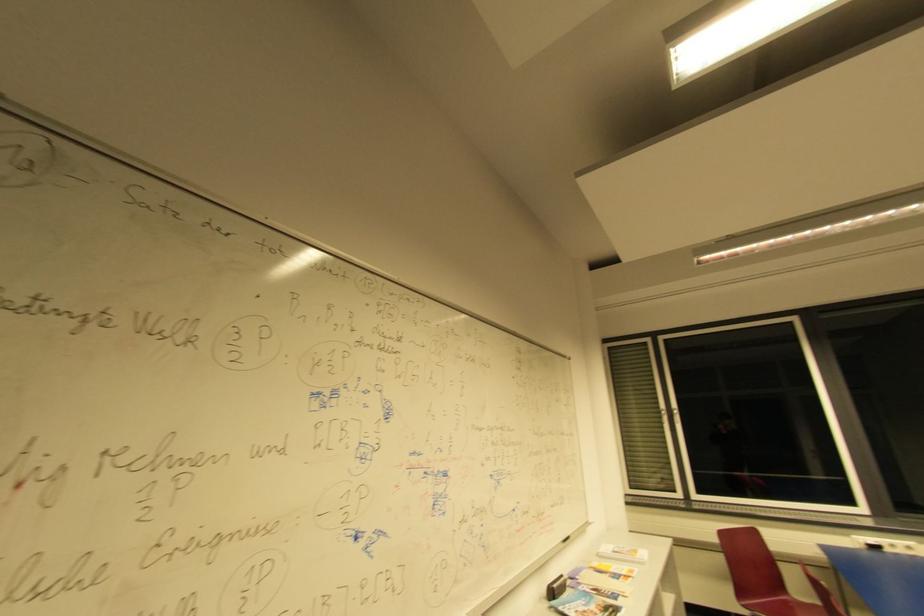
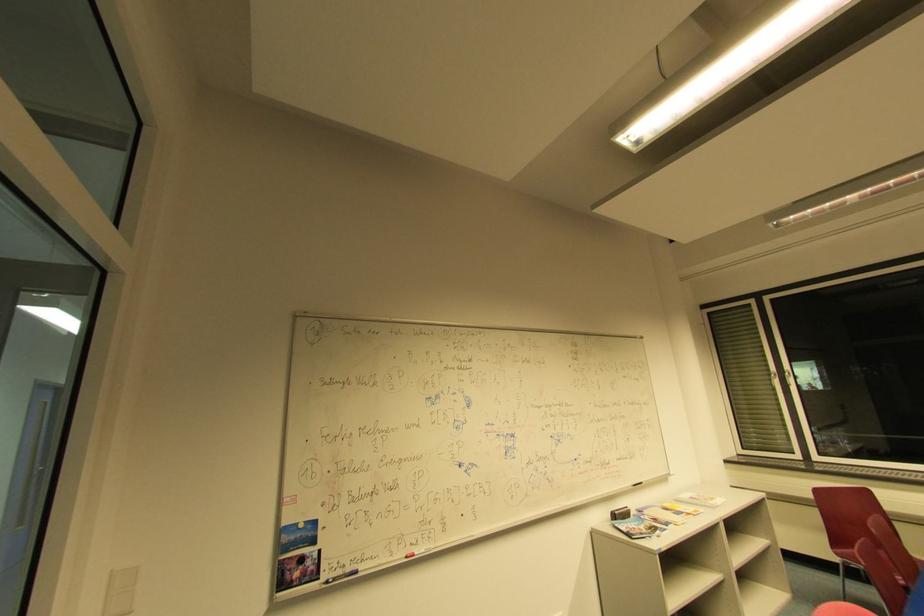
In the scene shown: The images are taken continuously from a first-person perspective. In which direction are you moving?

The cameraman moved toward right, backward.